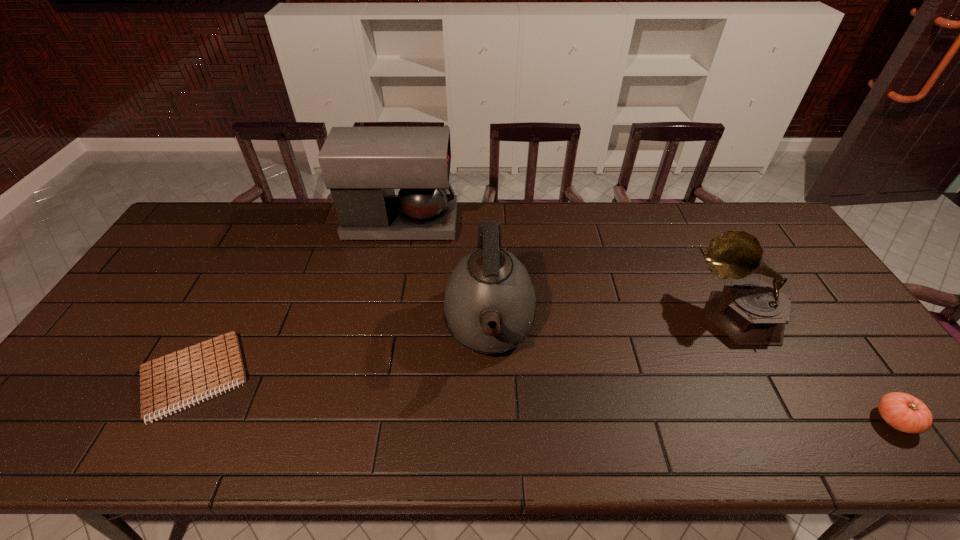
The width and height of the screenshot is (960, 540). I want to click on coffee maker, so click(362, 166).

The width and height of the screenshot is (960, 540). In order to click on kettle in this screenshot , I will do `click(489, 285)`.

I want to click on the second object from right to left, so click(x=750, y=311).

Identify the location of phonograph record. [x=750, y=311].

The image size is (960, 540). Identify the location of tomato. (903, 412).

Where is `the second shortest object`? The width and height of the screenshot is (960, 540). the second shortest object is located at coordinates (903, 412).

I want to click on the shortest object, so click(x=171, y=382).

Locate an element on the screen. The width and height of the screenshot is (960, 540). the leftmost object is located at coordinates (171, 382).

What are the coordinates of `vacant space located on the carafe side of the coffee maker` in the screenshot? It's located at (502, 224).

Identify the location of free space located at the spout of the kettle. (492, 451).